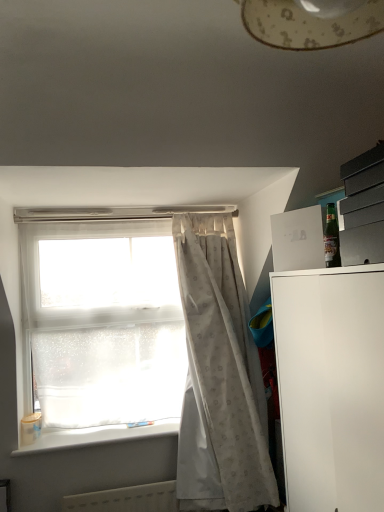
Question: From a real-world perspective, is white matte/file cabinet at right positioned under white textured curtain at center based on gravity?

Choices:
 (A) yes
 (B) no

Answer: (A)

Question: Is white matte/file cabinet at right shorter than white textured curtain at center?

Choices:
 (A) yes
 (B) no

Answer: (A)

Question: Is white matte/file cabinet at right positioned with its back to white textured curtain at center?

Choices:
 (A) yes
 (B) no

Answer: (B)

Question: Does white matte/file cabinet at right lie in front of white textured curtain at center?

Choices:
 (A) yes
 (B) no

Answer: (A)

Question: Is white matte/file cabinet at right in contact with white textured curtain at center?

Choices:
 (A) no
 (B) yes

Answer: (A)

Question: Does white matte/file cabinet at right turn towards white textured curtain at center?

Choices:
 (A) no
 (B) yes

Answer: (A)

Question: Can you confirm if white plastic radiator at lower center is positioned to the left of white plastic window sill at lower left?

Choices:
 (A) no
 (B) yes

Answer: (A)

Question: From a real-world perspective, is white plastic radiator at lower center on white plastic window sill at lower left?

Choices:
 (A) yes
 (B) no

Answer: (B)

Question: Is white plastic radiator at lower center turned away from white plastic window sill at lower left?

Choices:
 (A) yes
 (B) no

Answer: (B)

Question: Considering the relative positions of white plastic radiator at lower center and white plastic window sill at lower left in the image provided, is white plastic radiator at lower center in front of white plastic window sill at lower left?

Choices:
 (A) no
 (B) yes

Answer: (B)

Question: Is white plastic radiator at lower center aimed at white plastic window sill at lower left?

Choices:
 (A) no
 (B) yes

Answer: (A)

Question: Is white plastic window sill at lower left located within white plastic radiator at lower center?

Choices:
 (A) no
 (B) yes

Answer: (A)

Question: From a real-world perspective, is white plastic radiator at lower center over transparent plastic window at upper left?

Choices:
 (A) no
 (B) yes

Answer: (A)